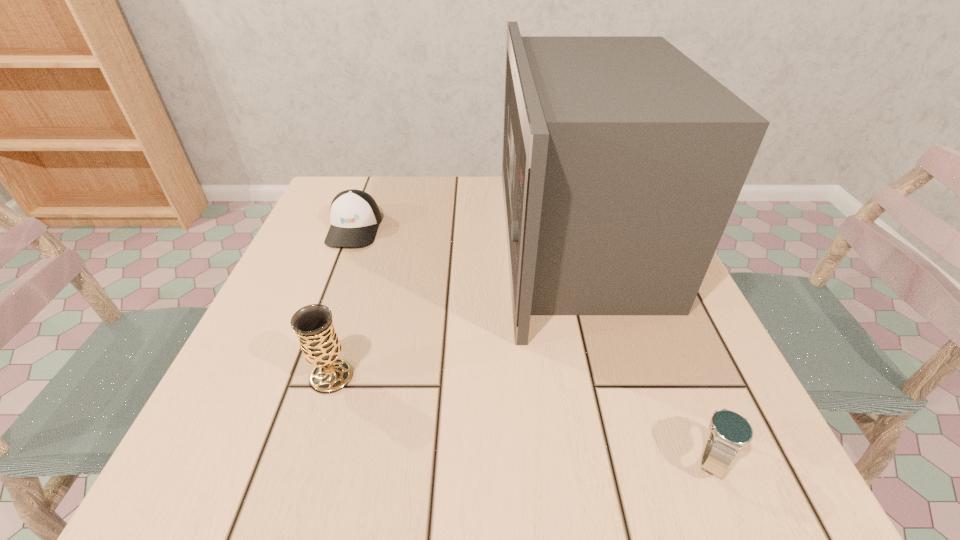
Identify the location of the tallest object. This screenshot has height=540, width=960. (623, 159).

The height and width of the screenshot is (540, 960). I want to click on the second tallest object, so click(x=313, y=324).

The image size is (960, 540). In order to click on the second nearest object in this screenshot , I will do `click(313, 324)`.

Locate an element on the screen. This screenshot has height=540, width=960. cap is located at coordinates (354, 215).

Locate an element on the screen. watch is located at coordinates (730, 431).

Where is `vacant space located on the front-facing side of the tallest object`? The image size is (960, 540). vacant space located on the front-facing side of the tallest object is located at coordinates (479, 241).

The image size is (960, 540). I want to click on vacant space located 0.090m on the front-facing side of the tallest object, so click(x=461, y=241).

Locate an element on the screen. The height and width of the screenshot is (540, 960). free space located 0.120m on the front-facing side of the tallest object is located at coordinates point(446,241).

I want to click on free space located 0.240m on the right of the third farthest object, so click(x=508, y=376).

Identify the location of blank space located on the front panel of the cap. The image size is (960, 540). (310, 347).